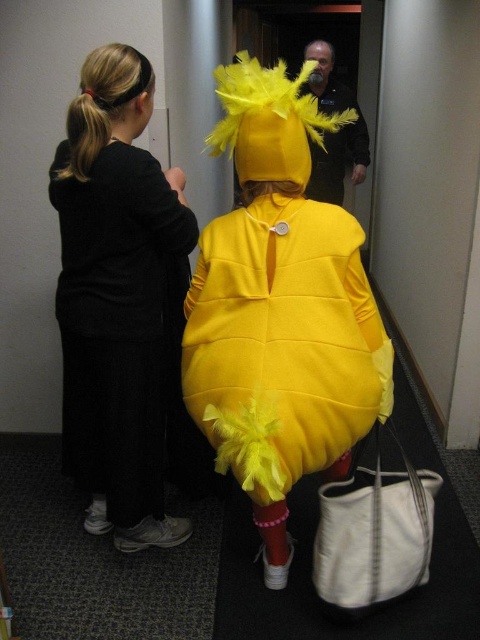
Is point (75, 232) behind point (349, 240)?

Yes, point (75, 232) is farther from viewer.

Does black fabric dress at left have a larger size compared to matte yellow costume at center?

Yes.

Is point (100, 502) behind point (331, 348)?

Yes, it is.

You are a GUI agent. You are given a task and a screenshot of the screen. Output one action in this format:
    pyautogui.click(x=<x>, y=<y>)
    Task: Click on the black fabric dress at left
    The height and width of the screenshot is (640, 480).
    Given the screenshot: What is the action you would take?
    pyautogui.click(x=116, y=298)